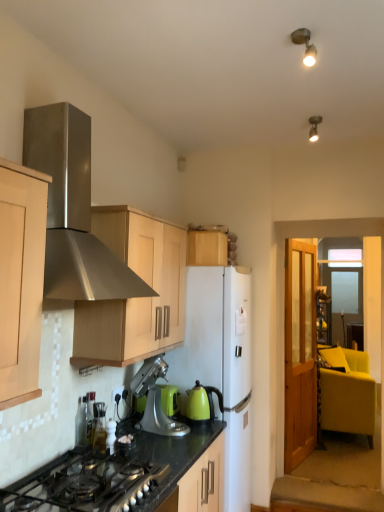
Question: Is brushed metal toaster at lower left, the second appliance in the front-to-back sequence, positioned with its back to black matte gas stove at lower left?

Choices:
 (A) no
 (B) yes

Answer: (A)

Question: Can you confirm if brushed metal toaster at lower left, the second appliance viewed from the back, is bigger than black matte gas stove at lower left?

Choices:
 (A) no
 (B) yes

Answer: (A)

Question: Is brushed metal toaster at lower left, the second appliance in the front-to-back sequence, located outside black matte gas stove at lower left?

Choices:
 (A) no
 (B) yes

Answer: (B)

Question: Does brushed metal toaster at lower left, which ranks as the third appliance in right-to-left order, have a lesser height compared to black matte gas stove at lower left?

Choices:
 (A) no
 (B) yes

Answer: (A)

Question: Considering the relative sizes of brushed metal toaster at lower left, the second appliance in the front-to-back sequence, and black matte gas stove at lower left in the image provided, is brushed metal toaster at lower left, the second appliance in the front-to-back sequence, smaller than black matte gas stove at lower left?

Choices:
 (A) no
 (B) yes

Answer: (B)

Question: Does brushed metal toaster at lower left, the second appliance in the front-to-back sequence, contain black matte gas stove at lower left?

Choices:
 (A) yes
 (B) no

Answer: (B)

Question: Considering the relative positions of stainless steel range hood at upper left and white matte refrigerator at center in the image provided, is stainless steel range hood at upper left behind white matte refrigerator at center?

Choices:
 (A) yes
 (B) no

Answer: (B)

Question: Is stainless steel range hood at upper left in front of white matte refrigerator at center?

Choices:
 (A) yes
 (B) no

Answer: (A)

Question: Is white matte refrigerator at center located within stainless steel range hood at upper left?

Choices:
 (A) yes
 (B) no

Answer: (B)

Question: Considering the relative sizes of stainless steel range hood at upper left and white matte refrigerator at center in the image provided, is stainless steel range hood at upper left thinner than white matte refrigerator at center?

Choices:
 (A) no
 (B) yes

Answer: (A)

Question: Is stainless steel range hood at upper left not within white matte refrigerator at center?

Choices:
 (A) yes
 (B) no

Answer: (A)

Question: Is stainless steel range hood at upper left at the right side of white matte refrigerator at center?

Choices:
 (A) no
 (B) yes

Answer: (A)

Question: Is metallic spot light at upper right, the 2th light fixture positioned from the right, not near black matte gas stove at lower left?

Choices:
 (A) no
 (B) yes

Answer: (B)